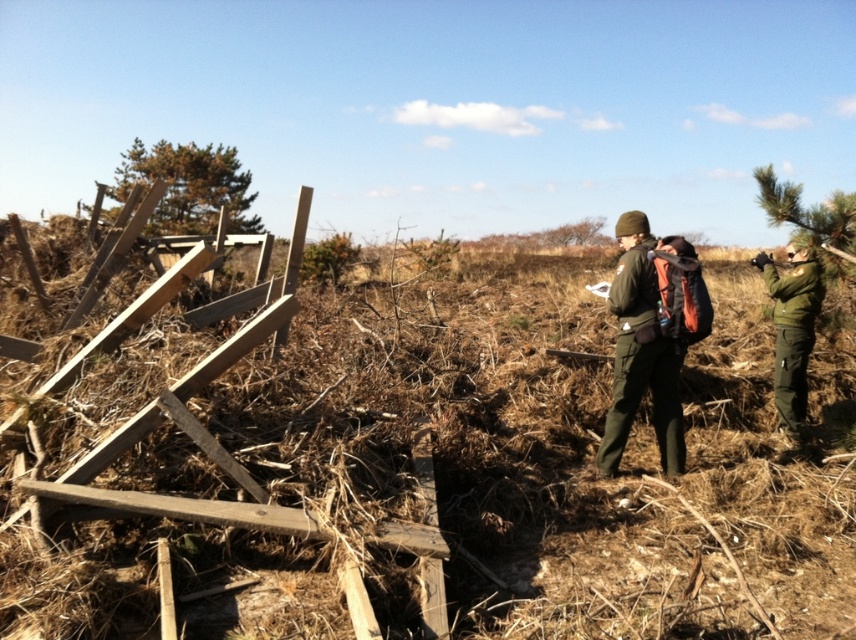
Question: Is green matte jacket at right further to the viewer compared to green textured pine tree at upper right?

Choices:
 (A) no
 (B) yes

Answer: (B)

Question: Which object is farther from the camera taking this photo?

Choices:
 (A) green matte uniform at center
 (B) green matte jacket at right
 (C) green textured pine tree at upper right

Answer: (B)

Question: Which is nearer to the green leafy tree at upper left?

Choices:
 (A) green matte uniform at center
 (B) green textured pine tree at upper right
 (C) green matte jacket at right

Answer: (C)

Question: Which of the following is the farthest from the observer?

Choices:
 (A) green matte jacket at right
 (B) green matte uniform at center
 (C) green leafy tree at upper left

Answer: (C)

Question: Considering the relative positions of green matte uniform at center and green leafy tree at upper left in the image provided, where is green matte uniform at center located with respect to green leafy tree at upper left?

Choices:
 (A) right
 (B) left

Answer: (A)

Question: Is green matte jacket at right above green textured pine tree at upper right?

Choices:
 (A) no
 (B) yes

Answer: (A)